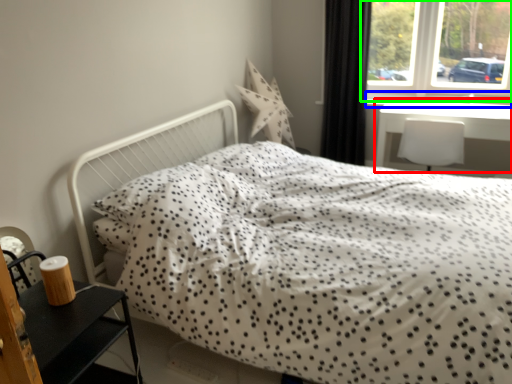
Question: Which is nearer to the table (highlighted by a red box)? window sill (highlighted by a blue box) or window (highlighted by a green box).

Choices:
 (A) window sill
 (B) window

Answer: (A)